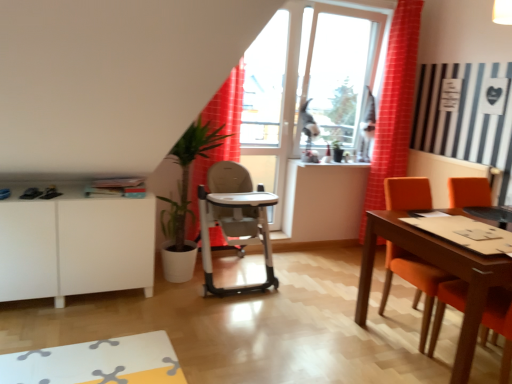
Identify the location of free space to the left of matte orange chair at right. The width and height of the screenshot is (512, 384). pos(342,319).